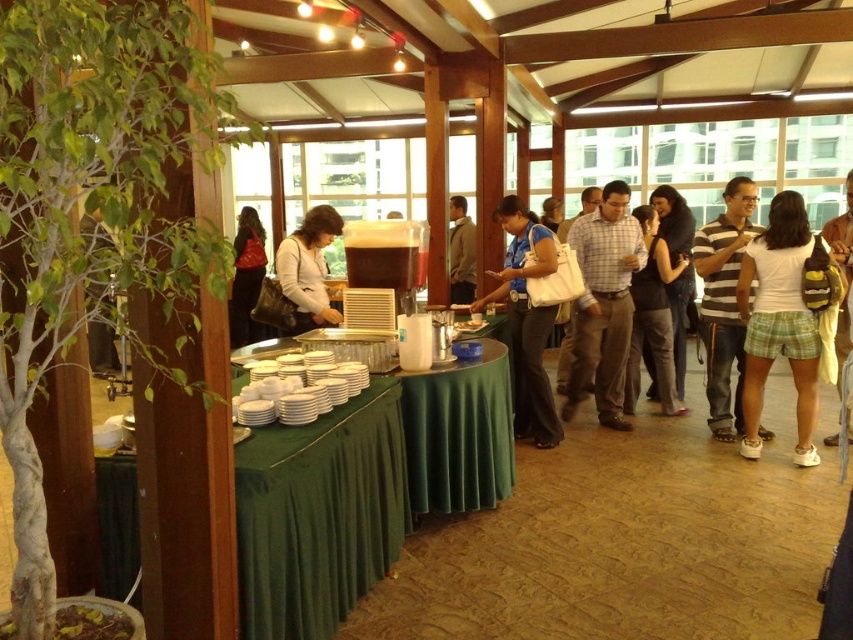
Does point (311, 234) come farther from viewer compared to point (245, 218)?

No, it is in front of (245, 218).

Between point (311, 285) and point (247, 252), which one is positioned in front?

Point (311, 285) is more forward.

Describe the element at coordinates (308, 269) in the screenshot. This screenshot has width=853, height=640. I see `white matte shirt at center` at that location.

Locate an element on the screen. This screenshot has height=640, width=853. white matte shirt at center is located at coordinates (308, 269).

Is blue fabric skirt at center to the left of white matte shirt at center from the viewer's perspective?

In fact, blue fabric skirt at center is to the right of white matte shirt at center.

Which is behind, point (519, 416) or point (335, 314)?

Point (519, 416)

This screenshot has height=640, width=853. Describe the element at coordinates (526, 321) in the screenshot. I see `blue fabric skirt at center` at that location.

At what (x,y) coordinates should I click in order to perform the action: click on blue fabric skirt at center. Please return your answer as a coordinate pair (x, y). Looking at the image, I should click on (526, 321).

Does white matte shirt at center appear under dark blue jeans at center?

No, white matte shirt at center is not below dark blue jeans at center.

Is point (322, 301) farther from camera compared to point (653, 390)?

No.

Between point (282, 269) and point (680, 228), which one is positioned in front?

Point (282, 269) is more forward.

At what (x,y) coordinates should I click in order to perform the action: click on white matte shirt at center. Please return your answer as a coordinate pair (x, y). Looking at the image, I should click on (308, 269).